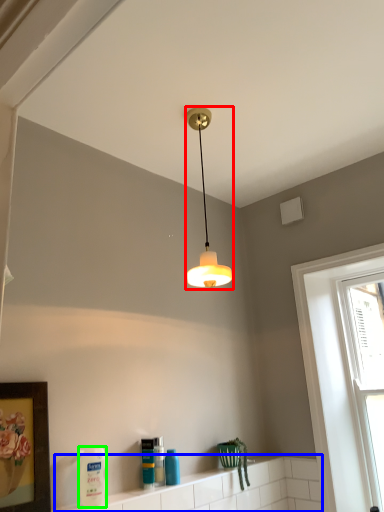
Question: Which object is positioned closest to lamp (highlighted by a red box)? Select from window sill (highlighted by a blue box) and cleaning product (highlighted by a green box).

Choices:
 (A) window sill
 (B) cleaning product

Answer: (B)